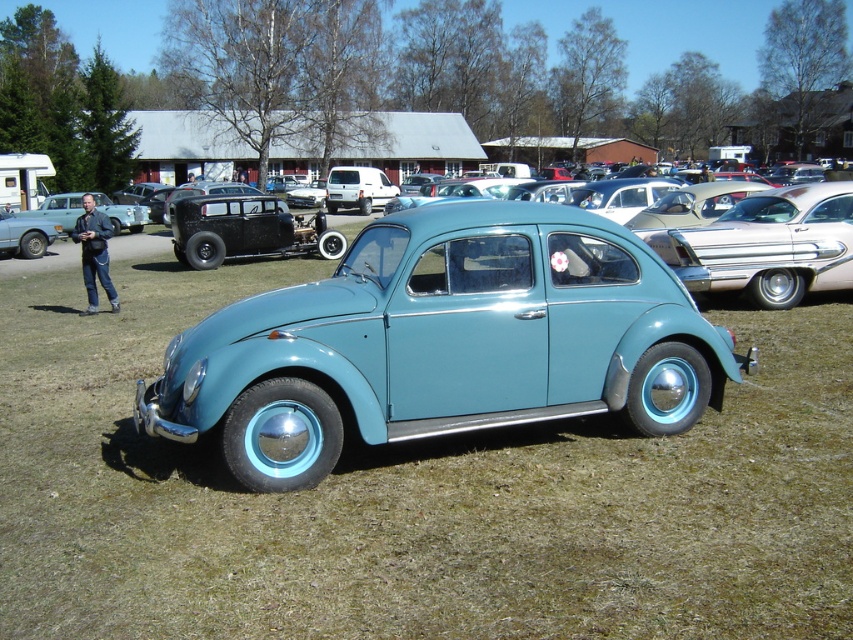
You are a photographer planning to take a photo of the light blue matte car at center and the shiny silver sedan at right. Considering their heights, which car should you position closer to the camera to ensure both appear balanced in the frame?

The light blue matte car at center is taller than the shiny silver sedan at right, so you should position the taller light blue matte car at center closer to the camera to balance their apparent sizes in the photo.

You are standing at the center of the vintage car event and see the point marked at coordinates [769,244]. What object does this point indicate?

The point at coordinates [769,244] marks the shiny silver sedan at right.